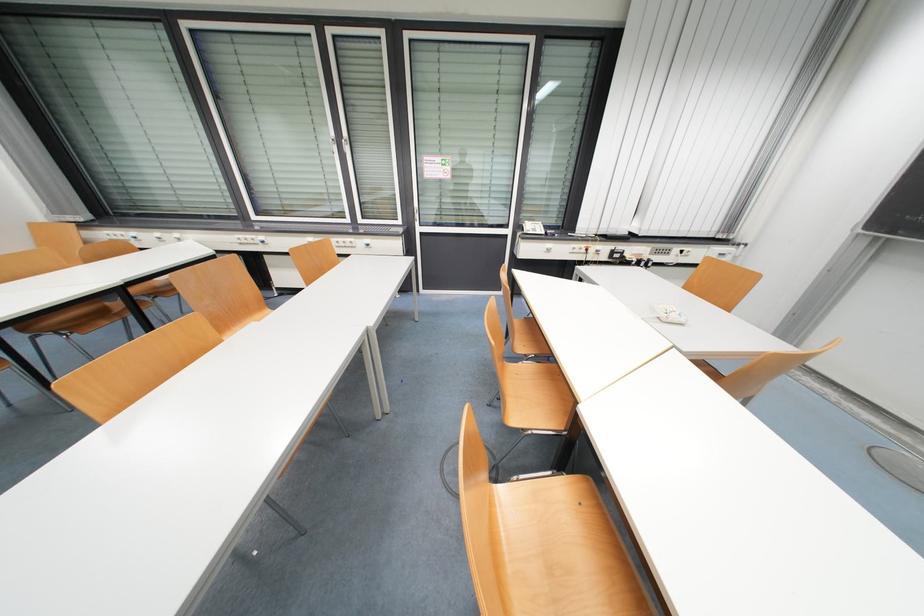
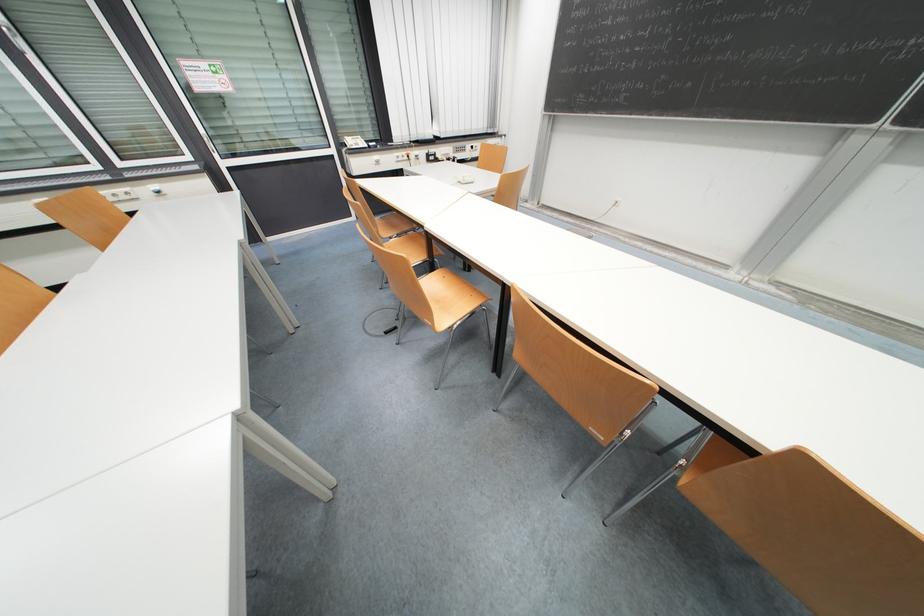
The images are taken continuously from a first-person perspective. In which direction is your viewpoint rotating?

The camera's rotation is toward right-down.